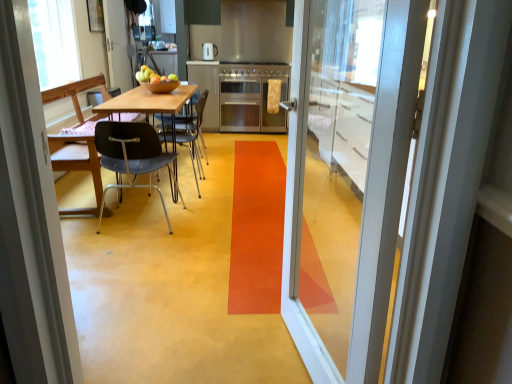
Locate an element on the screen. The image size is (512, 384). vacant area that is situated to the right of metallic blue chair at left, the third chair in the right-to-left sequence is located at coordinates (237, 186).